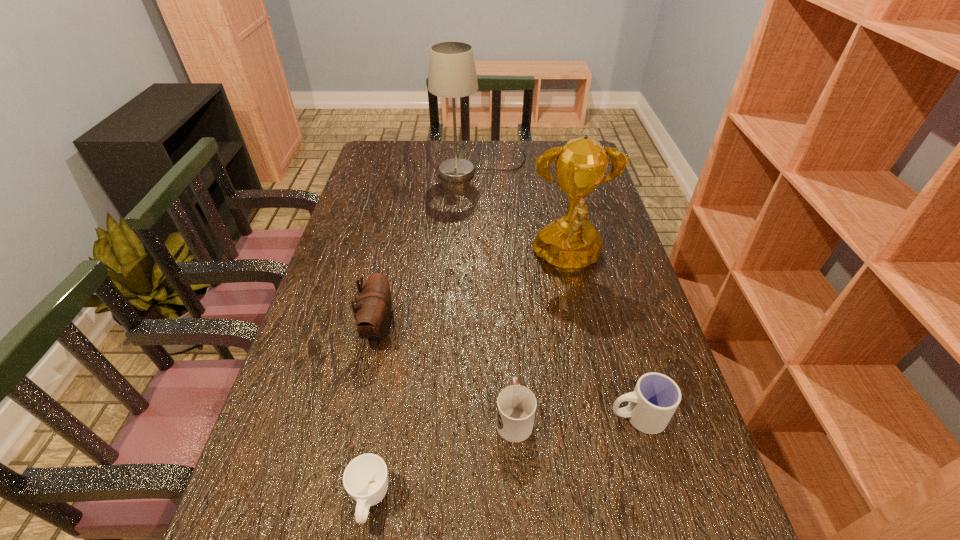
The width and height of the screenshot is (960, 540). I want to click on the farthest object, so click(x=452, y=73).

Locate an element on the screen. The height and width of the screenshot is (540, 960). table lamp is located at coordinates (452, 73).

Where is `the fifth nearest object`? The height and width of the screenshot is (540, 960). the fifth nearest object is located at coordinates (571, 243).

What are the coordinates of `award` in the screenshot? It's located at (571, 243).

This screenshot has height=540, width=960. In order to click on the third tallest object in this screenshot , I will do `click(373, 312)`.

Identify the location of the third farthest object. (373, 312).

The height and width of the screenshot is (540, 960). In order to click on the rightmost cup in this screenshot , I will do `click(655, 398)`.

At what (x,y) coordinates should I click in order to perform the action: click on the second cup from right to left. Please return your answer as a coordinate pair (x, y). This screenshot has height=540, width=960. Looking at the image, I should click on (516, 405).

I want to click on the nearest object, so click(x=365, y=479).

Find the location of a particular element. This screenshot has width=960, height=540. the shortest object is located at coordinates (365, 479).